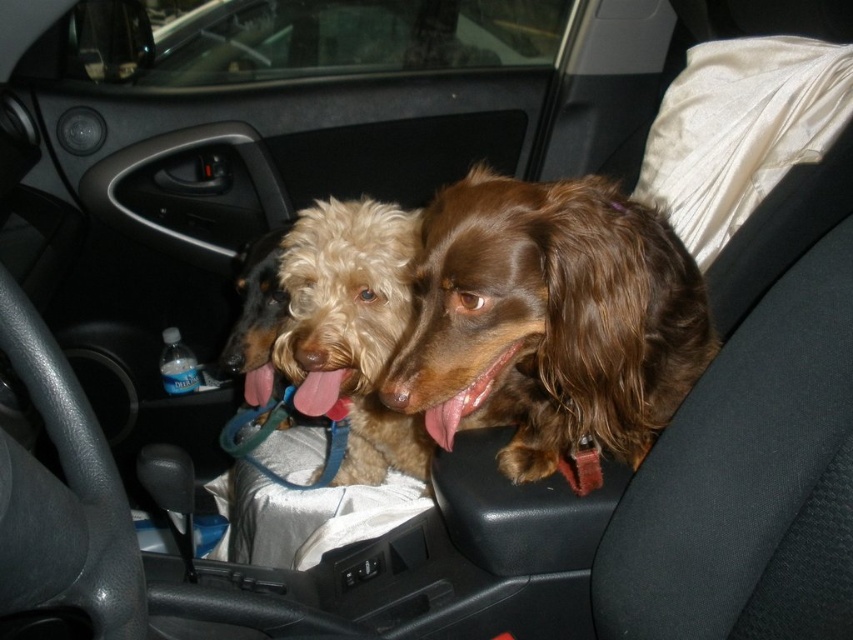
Does brown silky dog at center come in front of fuzzy brown dog at center?

Yes, it is in front of fuzzy brown dog at center.

This screenshot has height=640, width=853. What do you see at coordinates (548, 321) in the screenshot?
I see `brown silky dog at center` at bounding box center [548, 321].

Between point (451, 269) and point (341, 413), which one is positioned behind?

The point (341, 413) is behind.

Identify the location of brown silky dog at center. (548, 321).

Does point (312, 332) come closer to viewer compared to point (514, 344)?

That is False.

Is fuzzy brown dog at center closer to the viewer compared to pink glossy tongue at center?

No, fuzzy brown dog at center is further to the viewer.

Where is `fuzzy brown dog at center`? The image size is (853, 640). fuzzy brown dog at center is located at coordinates (337, 326).

Does point (427, 323) come behind point (519, 340)?

No.

Does brown silky dog at center have a lesser height compared to pink glossy tongue at center?

Incorrect, brown silky dog at center's height does not fall short of pink glossy tongue at center's.

Does point (643, 445) come farther from viewer compared to point (500, 364)?

Yes, it is.

At what (x,y) coordinates should I click in order to perform the action: click on brown silky dog at center. Please return your answer as a coordinate pair (x, y). Looking at the image, I should click on (548, 321).